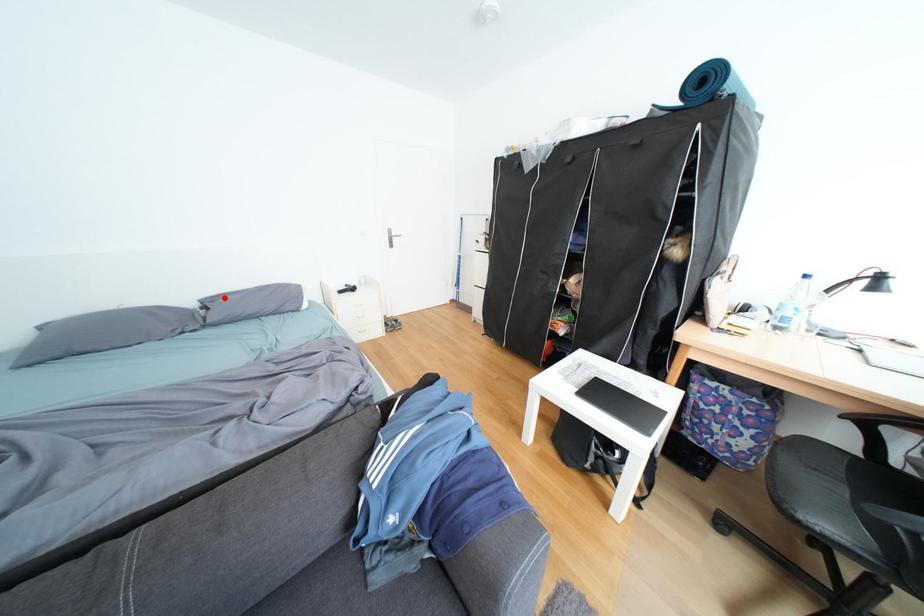
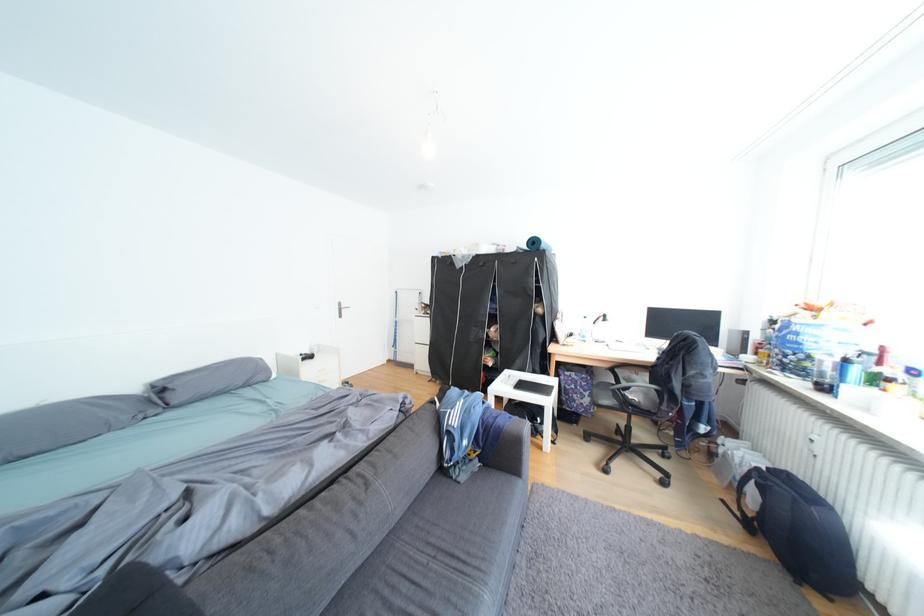
Find the pixel in the second image that matches the highlighted location in the first image.

(177, 379)